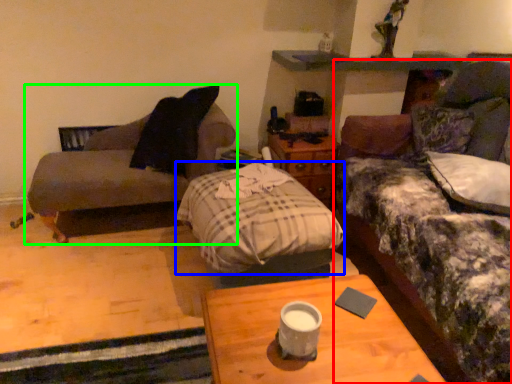
Question: Which is farther away from studio couch (highlighted by a red box)? bedding (highlighted by a blue box) or studio couch (highlighted by a green box)?

Choices:
 (A) bedding
 (B) studio couch

Answer: (B)